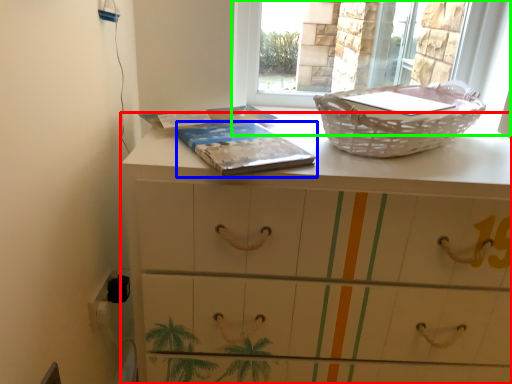
Question: Which object is the closest to the chest of drawers (highlighted by a red box)? Choose among these: paperback book (highlighted by a blue box) or window (highlighted by a green box).

Choices:
 (A) paperback book
 (B) window

Answer: (A)